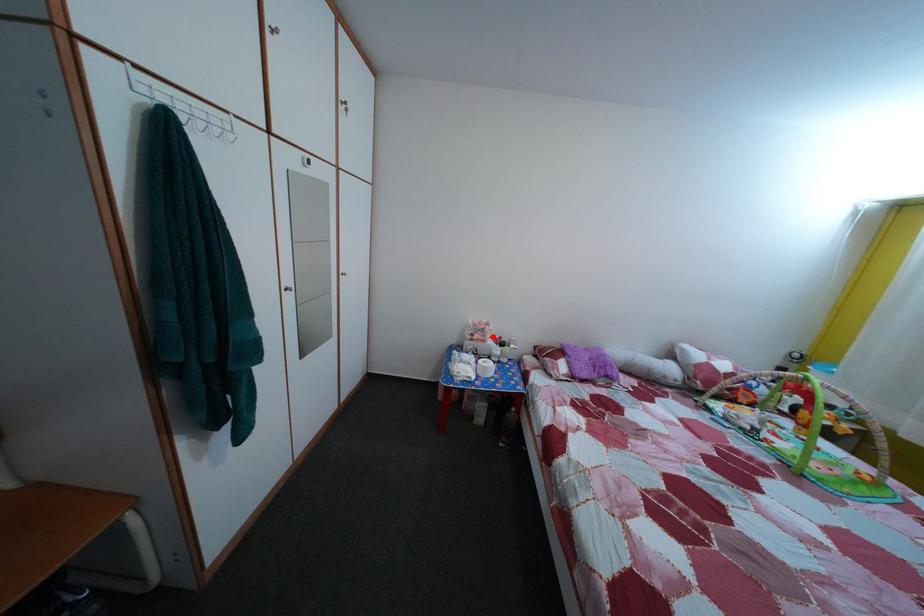
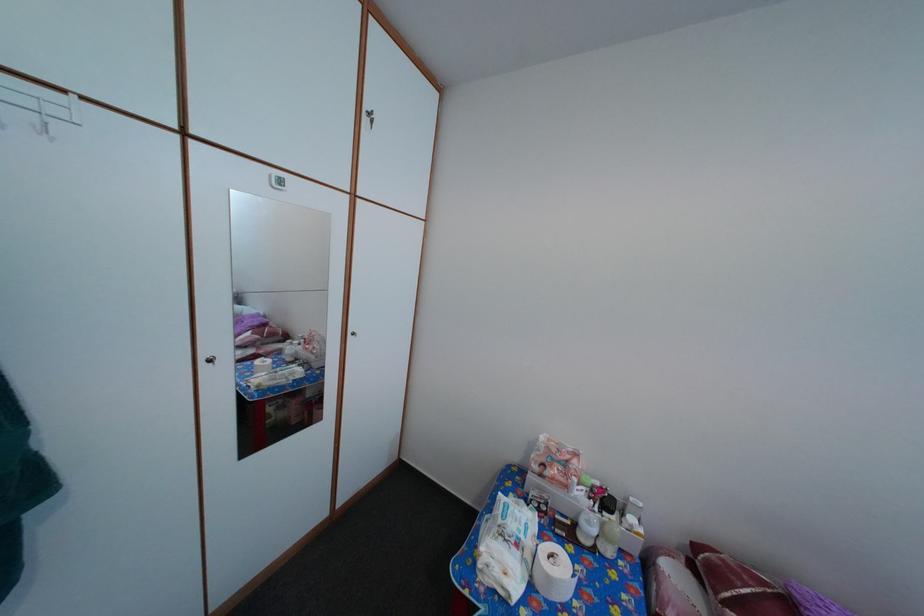
The point at the highlighted location is marked in the first image. Where is the corresponding point in the second image?

(576, 469)